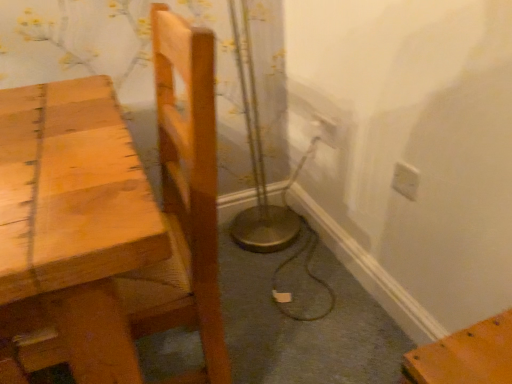
Locate an element on the screen. The width and height of the screenshot is (512, 384). light brown wooden chair at left is located at coordinates (184, 202).

Locate an element on the screen. Image resolution: width=512 pixels, height=384 pixels. light brown wooden chair at left is located at coordinates (184, 202).

Is white plastic electric outlet at upper right, the first electric outlet in the back-to-front sequence, positioned with its back to light brown wooden chair at left?

No, light brown wooden chair at left is not at the back of white plastic electric outlet at upper right, the first electric outlet in the back-to-front sequence.

From the image's perspective, count 2nd electric outlets upward from the light brown wooden chair at left and point to it. Please provide its 2D coordinates.

[(325, 130)]

Can you tell me how much white plastic electric outlet at upper right, the 2th electric outlet when ordered from bottom to top, and light brown wooden chair at left differ in facing direction?

The angle between the facing direction of white plastic electric outlet at upper right, the 2th electric outlet when ordered from bottom to top, and the facing direction of light brown wooden chair at left is 1.62 degrees.

Does white plastic electric outlet at upper right, the first electric outlet in the back-to-front sequence, lie behind light brown wooden chair at left?

Yes, white plastic electric outlet at upper right, the first electric outlet in the back-to-front sequence, is further from the viewer.

Is white plastic electric outlet at upper right, acting as the 1th electric outlet starting from the left, inside light brown wooden chair at left?

Actually, white plastic electric outlet at upper right, acting as the 1th electric outlet starting from the left, is outside light brown wooden chair at left.

Is light brown wooden chair at left shorter than white plastic electric outlet at upper right, the 2th electric outlet when ordered from bottom to top?

In fact, light brown wooden chair at left may be taller than white plastic electric outlet at upper right, the 2th electric outlet when ordered from bottom to top.

Which object is further away from the camera, light brown wooden chair at left or white plastic electric outlet at upper right, the 2th electric outlet when ordered from bottom to top?

white plastic electric outlet at upper right, the 2th electric outlet when ordered from bottom to top, is further away from the camera.

From a real-world perspective, is white plastic electric outlet at upper right, which is counted as the 2th electric outlet, starting from the front, positioned under white plastic electric outlet at upper right, placed as the 1th electric outlet when sorted from bottom to top, based on gravity?

Yes, from a real-world perspective, white plastic electric outlet at upper right, which is counted as the 2th electric outlet, starting from the front, is under white plastic electric outlet at upper right, placed as the 1th electric outlet when sorted from bottom to top.

Which object is closer to the camera taking this photo, white plastic electric outlet at upper right, the first electric outlet in the back-to-front sequence, or white plastic electric outlet at upper right, the second electric outlet when ordered from left to right?

white plastic electric outlet at upper right, the second electric outlet when ordered from left to right, is more forward.

In terms of height, does light brown wooden chair at left look taller or shorter compared to white plastic electric outlet at upper right, marked as the first electric outlet in a front-to-back arrangement?

Clearly, light brown wooden chair at left is taller compared to white plastic electric outlet at upper right, marked as the first electric outlet in a front-to-back arrangement.

From a real-world perspective, does light brown wooden chair at left stand above white plastic electric outlet at upper right, the first electric outlet positioned from the right?

Yes, from a real-world perspective, light brown wooden chair at left is over white plastic electric outlet at upper right, the first electric outlet positioned from the right

Is light brown wooden chair at left smaller than white plastic electric outlet at upper right, which is the 2th electric outlet in back-to-front order?

Actually, light brown wooden chair at left might be larger than white plastic electric outlet at upper right, which is the 2th electric outlet in back-to-front order.

Does point (395, 172) come in front of point (166, 218)?

No.

Is white plastic electric outlet at upper right, positioned as the 2th electric outlet in top-to-bottom order, spatially inside light brown wooden chair at left, or outside of it?

The correct answer is: outside.

Who is taller, white plastic electric outlet at upper right, positioned as the 2th electric outlet in top-to-bottom order, or light brown wooden chair at left?

Standing taller between the two is light brown wooden chair at left.

From a real-world perspective, who is located higher, white plastic electric outlet at upper right, which is the 2th electric outlet in back-to-front order, or light brown wooden chair at left?

In real-world perspective, light brown wooden chair at left is above.

Considering the positions of objects white plastic electric outlet at upper right, placed as the 1th electric outlet when sorted from bottom to top, and white plastic electric outlet at upper right, acting as the 1th electric outlet starting from the left, in the image provided, who is more to the left, white plastic electric outlet at upper right, placed as the 1th electric outlet when sorted from bottom to top, or white plastic electric outlet at upper right, acting as the 1th electric outlet starting from the left,?

white plastic electric outlet at upper right, acting as the 1th electric outlet starting from the left.

Considering their positions, is white plastic electric outlet at upper right, the first electric outlet positioned from the right, located in front of or behind white plastic electric outlet at upper right, which is counted as the 2th electric outlet, starting from the front?

Clearly, white plastic electric outlet at upper right, the first electric outlet positioned from the right, is in front of white plastic electric outlet at upper right, which is counted as the 2th electric outlet, starting from the front.

Which of these two, white plastic electric outlet at upper right, marked as the first electric outlet in a front-to-back arrangement, or white plastic electric outlet at upper right, acting as the 1th electric outlet starting from the left, is bigger?

Bigger between the two is white plastic electric outlet at upper right, acting as the 1th electric outlet starting from the left.

This screenshot has width=512, height=384. Identify the location of chair above the white plastic electric outlet at upper right, the first electric outlet positioned from the top (from a real-world perspective). (184, 202).

The image size is (512, 384). What are the coordinates of `chair below the white plastic electric outlet at upper right, acting as the 1th electric outlet starting from the left (from the image's perspective)` in the screenshot? It's located at (184, 202).

Based on their spatial positions, is white plastic electric outlet at upper right, which is counted as the 2th electric outlet, starting from the front, or white plastic electric outlet at upper right, positioned as the 2th electric outlet in top-to-bottom order, closer to light brown wooden chair at left?

The object closer to light brown wooden chair at left is white plastic electric outlet at upper right, positioned as the 2th electric outlet in top-to-bottom order.

When comparing their distances from light brown wooden chair at left, does white plastic electric outlet at upper right, placed as the 1th electric outlet when sorted from bottom to top, or white plastic electric outlet at upper right, the first electric outlet in the back-to-front sequence, seem further?

The object further to light brown wooden chair at left is white plastic electric outlet at upper right, the first electric outlet in the back-to-front sequence.

Which object lies nearer to the anchor point white plastic electric outlet at upper right, the second electric outlet positioned from the right, light brown wooden chair at left or white plastic electric outlet at upper right, the first electric outlet positioned from the right?

white plastic electric outlet at upper right, the first electric outlet positioned from the right, is positioned closer to the anchor white plastic electric outlet at upper right, the second electric outlet positioned from the right.

When comparing their distances from white plastic electric outlet at upper right, marked as the first electric outlet in a front-to-back arrangement, does light brown wooden chair at left or white plastic electric outlet at upper right, acting as the 1th electric outlet starting from the left, seem further?

light brown wooden chair at left.

Consider the image. Looking at the image, which one is located further to white plastic electric outlet at upper right, which is counted as the 2th electric outlet, starting from the front, white plastic electric outlet at upper right, the first electric outlet positioned from the right, or light brown wooden chair at left?

Based on the image, light brown wooden chair at left appears to be further to white plastic electric outlet at upper right, which is counted as the 2th electric outlet, starting from the front.

From the image, which object appears to be farther from white plastic electric outlet at upper right, placed as the 1th electric outlet when sorted from bottom to top, white plastic electric outlet at upper right, the 2th electric outlet when ordered from bottom to top, or light brown wooden chair at left?

light brown wooden chair at left is positioned further to the anchor white plastic electric outlet at upper right, placed as the 1th electric outlet when sorted from bottom to top.

The width and height of the screenshot is (512, 384). Identify the location of electric outlet positioned between light brown wooden chair at left and white plastic electric outlet at upper right, the 2th electric outlet when ordered from bottom to top, from near to far. (406, 180).